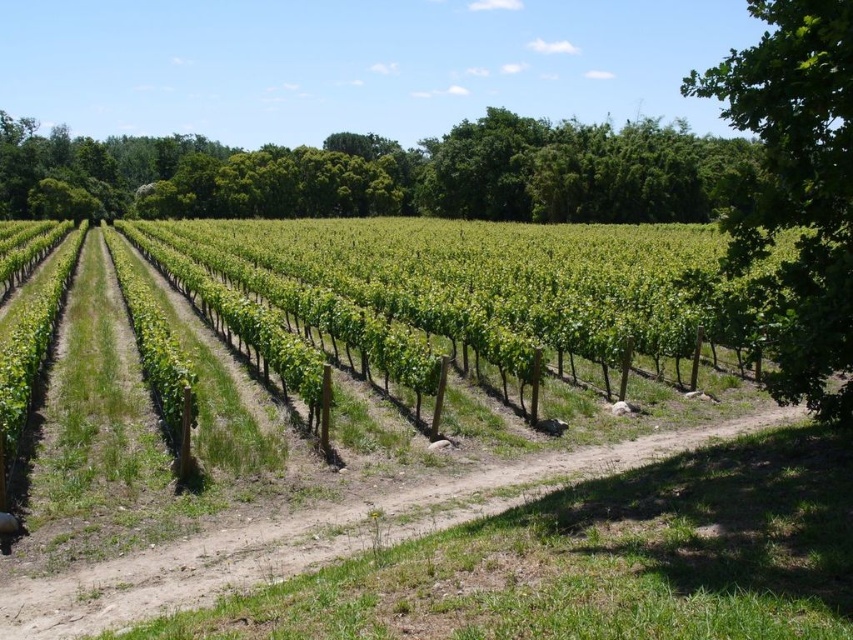
You are a tourist walking along the dirt path at lower center in the vineyard. You want to take a photo of the green leafy tree at right. Which direction should you face to capture the tree in your view?

The green leafy tree at right is positioned on the right side of dirt path at lower center, so you should face to the right to capture the tree in your view.

You are standing in the vineyard and see the point marked at coordinates [386,173]. What object is located at that point?

The green leafy tree at upper right is located at point [386,173].